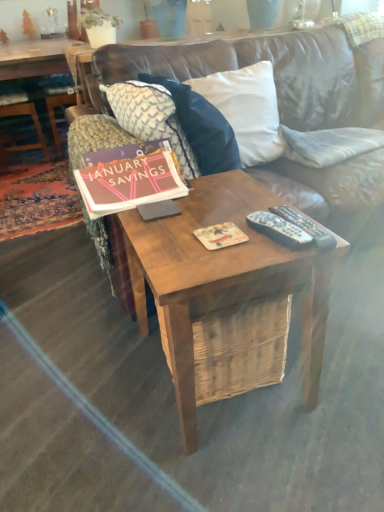
You are a GUI agent. You are given a task and a screenshot of the screen. Output one action in this format:
    pyautogui.click(x=<x>, y=<y>)
    Task: Click on the free location to the left of black plastic remote controls at center, placed as the 1th remote control when sorted from left to right
    The image size is (384, 512).
    Given the screenshot: What is the action you would take?
    pyautogui.click(x=213, y=240)